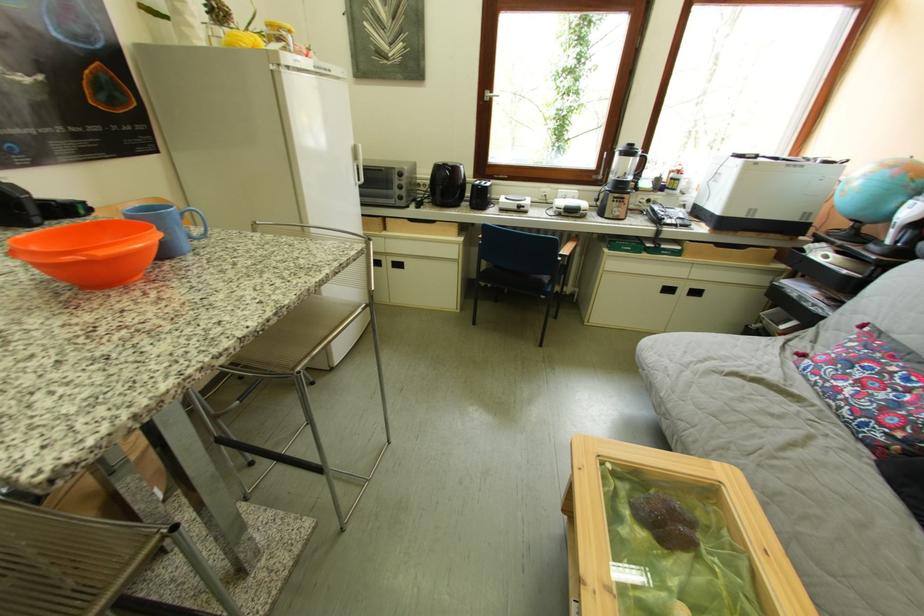
The width and height of the screenshot is (924, 616). What do you see at coordinates (628, 213) in the screenshot?
I see `a blender pitcher` at bounding box center [628, 213].